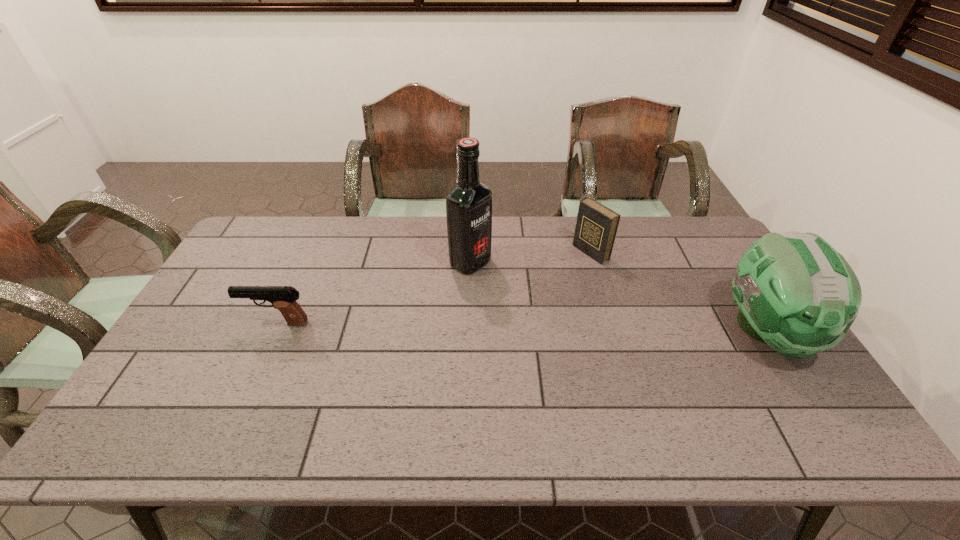
Where is `free space between the diary and the tallest object`? free space between the diary and the tallest object is located at coordinates (531, 258).

Identify the location of unoccupied position between the shortest object and the football helmet. (521, 327).

Locate an element on the screen. free space that is in between the liquor and the shortest object is located at coordinates (373, 293).

I want to click on free space between the second tallest object and the liquor, so click(618, 297).

The width and height of the screenshot is (960, 540). Identify the location of free space between the leftmost object and the second shortest object. (434, 288).

The width and height of the screenshot is (960, 540). Identify the location of vacant area between the rightmost object and the second shortest object. [x=679, y=292].

Identify which object is the third nearest to the rightmost object. Please provide its 2D coordinates. Your answer should be formatted as a tuple, i.e. [(x, y)], where the tuple contains the x and y coordinates of a point satisfying the conditions above.

[(283, 298)]

This screenshot has width=960, height=540. Find the location of `object that is the closest to the liquor`. object that is the closest to the liquor is located at coordinates (596, 226).